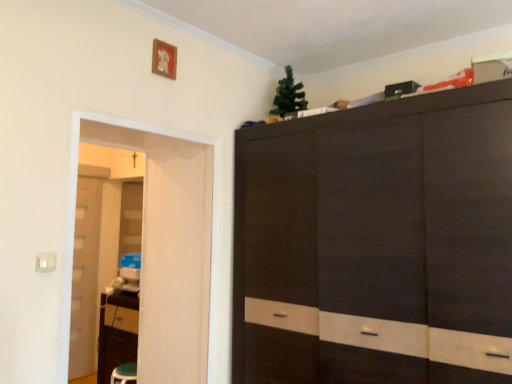
The height and width of the screenshot is (384, 512). What are the coordinates of `vacant area on top of translucent plastic screen door at left (from a real-world perspective)` in the screenshot? It's located at (155, 120).